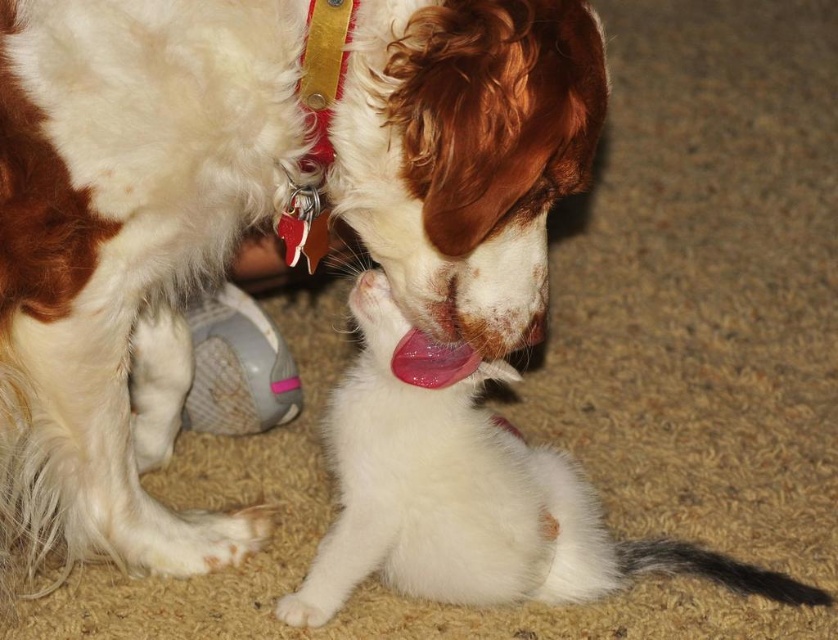
You are a photographer trying to capture the perfect shot of the white fluffy dog at center. Based on the coordinates provided, where should you position your camera relative to the dog to ensure it is centered in your frame?

The white fluffy dog at center is located at coordinates point [249,214]. To center the dog in your frame, position your camera so that the center of your viewfinder aligns with these coordinates.

You are standing in the room where the dog and kitten are. You want to place a small toy exactly at the point marked by coordinates point (249, 214). Will the toy be placed near the white fluffy dog at center?

Yes, the point (249, 214) corresponds to the white fluffy dog at center, so placing the toy there will put it near the dog.